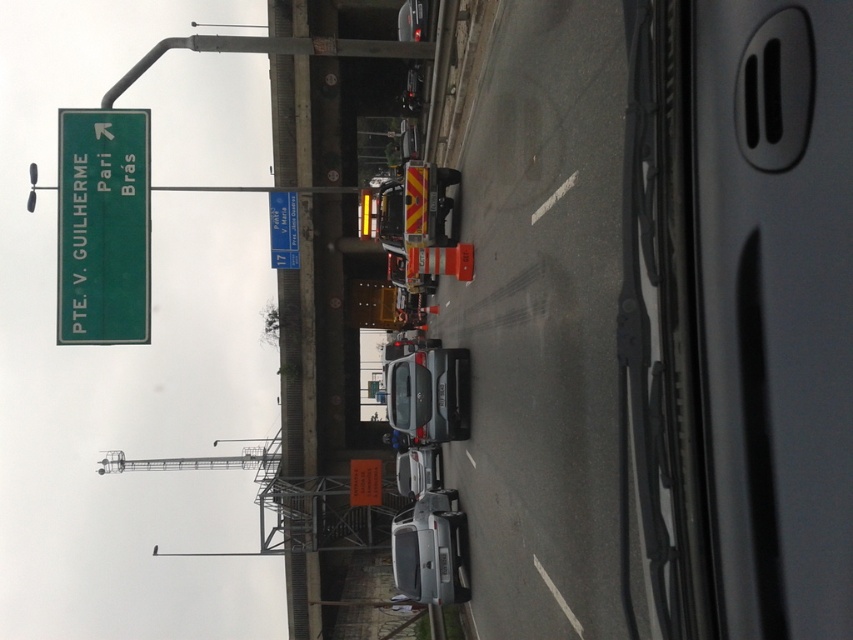
Can you confirm if green matte sign at upper left is shorter than blue plastic road sign at center?

No.

Between point (119, 310) and point (294, 193), which one is positioned in front?

Point (119, 310)

Which is behind, point (96, 131) or point (286, 218)?

Positioned behind is point (286, 218).

In order to click on green matte sign at upper left in this screenshot , I will do `click(103, 227)`.

Does green matte sign at upper left have a smaller size compared to silver metallic sedan at center?

Yes.

Between point (140, 195) and point (451, 493), which one is positioned in front?

Point (140, 195)

Locate an element on the screen. The height and width of the screenshot is (640, 853). green matte sign at upper left is located at coordinates [103, 227].

Can you confirm if silver metallic sedan at center is positioned to the left of blue plastic road sign at center?

In fact, silver metallic sedan at center is to the right of blue plastic road sign at center.

From the picture: Which is more to the right, silver metallic sedan at center or blue plastic road sign at center?

From the viewer's perspective, silver metallic sedan at center appears more on the right side.

Is point (440, 586) less distant than point (279, 236)?

Yes, it is.

This screenshot has width=853, height=640. In order to click on silver metallic sedan at center in this screenshot , I will do `click(431, 548)`.